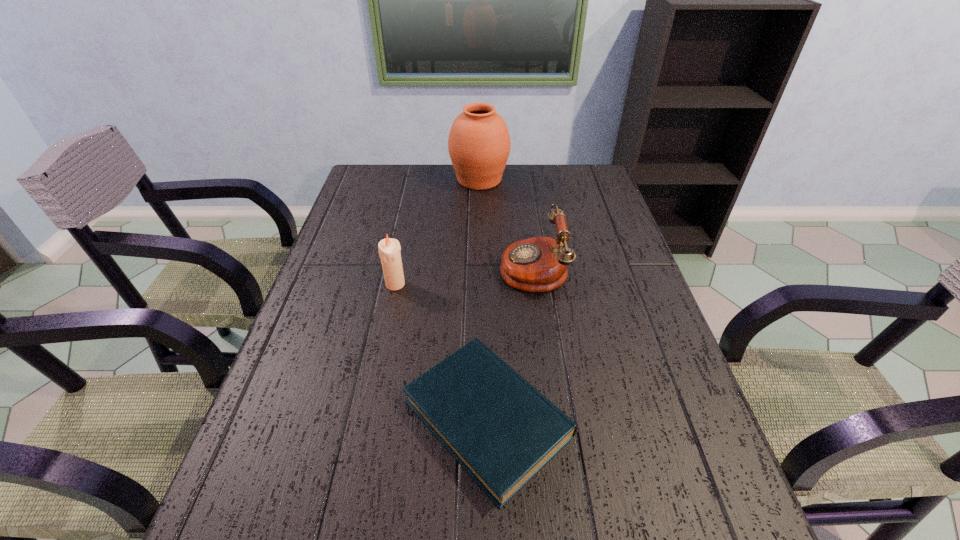
You are a GUI agent. You are given a task and a screenshot of the screen. Output one action in this format:
    pyautogui.click(x=<x>, y=<y>)
    Task: Click on the empty space that is in between the telephone and the tallest object
    
    Given the screenshot: What is the action you would take?
    pyautogui.click(x=506, y=222)

Find the location of a particular element. This screenshot has width=960, height=540. free point between the urn and the telephone is located at coordinates (506, 222).

Identify the location of vacant point located between the urn and the telephone. This screenshot has height=540, width=960. (506, 222).

Where is `vacant area that lies between the tallest object and the telephone`? The height and width of the screenshot is (540, 960). vacant area that lies between the tallest object and the telephone is located at coordinates [x=506, y=222].

I want to click on free spot between the leftmost object and the tallest object, so click(438, 232).

Where is `unoccupied area between the book and the leftmost object`? The width and height of the screenshot is (960, 540). unoccupied area between the book and the leftmost object is located at coordinates (442, 351).

The height and width of the screenshot is (540, 960). I want to click on free spot between the tallest object and the telephone, so click(506, 222).

The image size is (960, 540). In order to click on empty space that is in between the nearest object and the leftmost object in this screenshot , I will do `click(442, 351)`.

At what (x,y) coordinates should I click in order to perform the action: click on object that can be found as the third closest to the candle. Please return your answer as a coordinate pair (x, y). The width and height of the screenshot is (960, 540). Looking at the image, I should click on (479, 143).

The height and width of the screenshot is (540, 960). Identify the location of the second closest object to the candle. (539, 264).